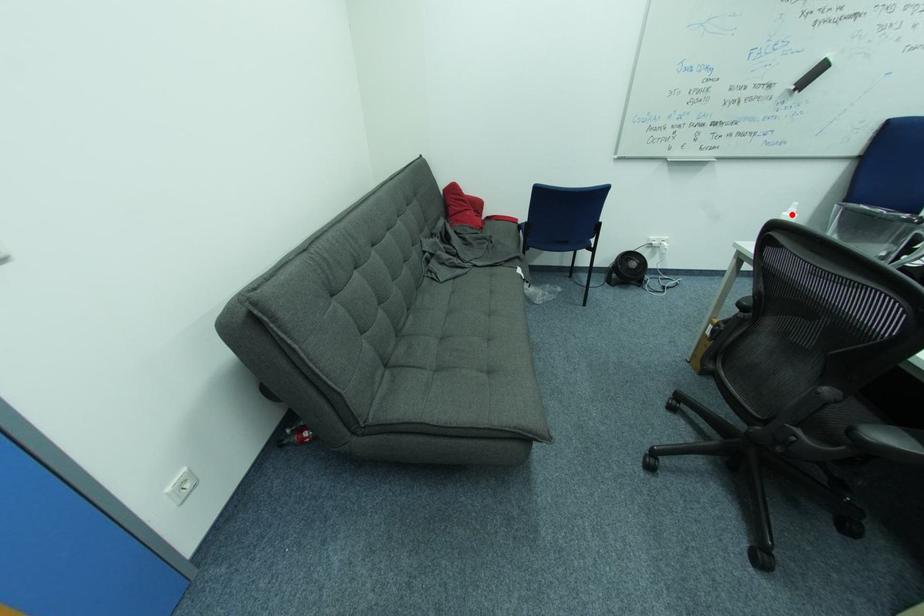
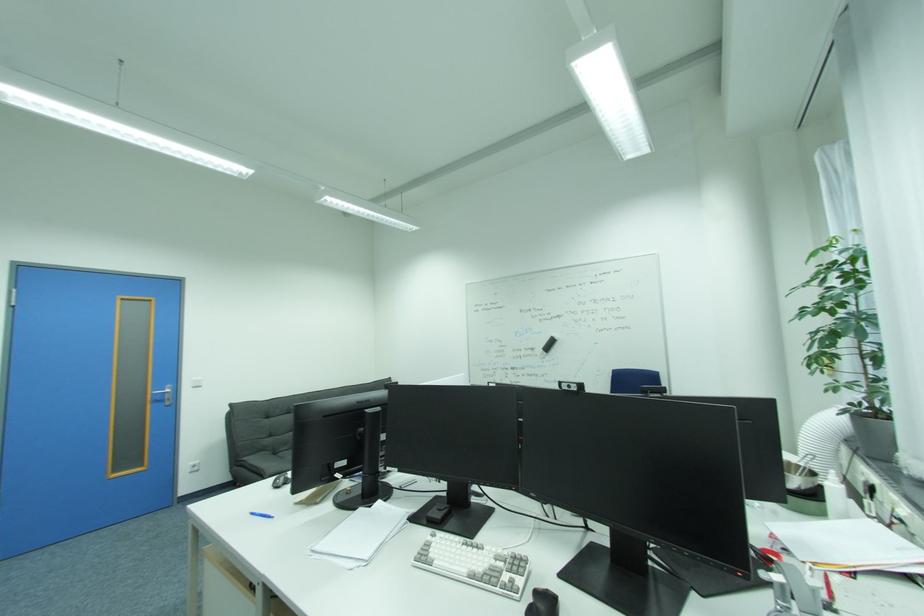
Question: I am providing you with two images of the same scene from different viewpoints. A red point is marked on the first image. At the location where the point appears in image 1, is it still visible in image 2?

Choices:
 (A) Yes
 (B) No

Answer: (B)